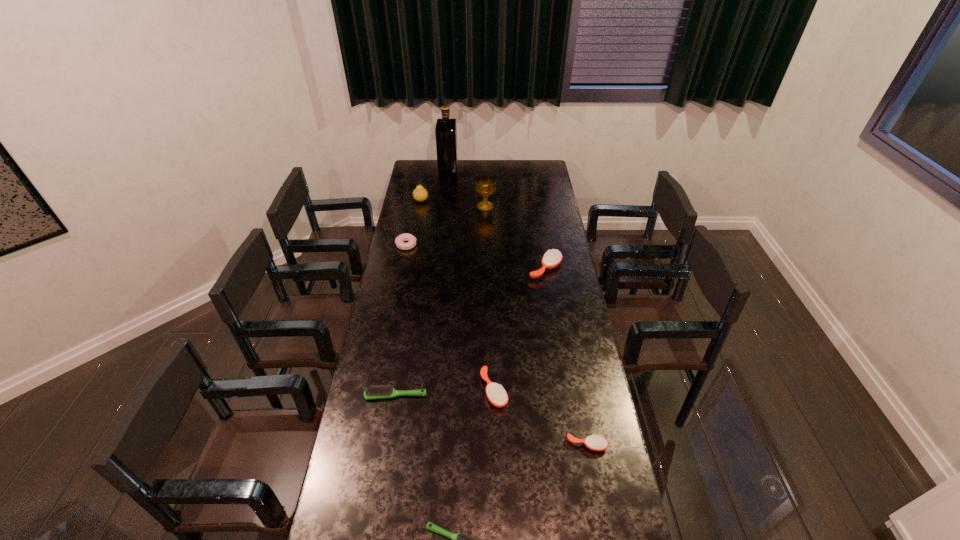
I want to click on free spot between the purple doughnut and the biggest orange hairbrush, so click(476, 256).

This screenshot has height=540, width=960. In order to click on empty location between the fifth farthest object and the nearest orange hairbrush in this screenshot , I will do `click(566, 357)`.

Image resolution: width=960 pixels, height=540 pixels. Find the location of `free area in between the liquor and the eighth shortest object`. free area in between the liquor and the eighth shortest object is located at coordinates (467, 187).

The height and width of the screenshot is (540, 960). I want to click on unoccupied position between the doughnut and the seventh shortest object, so click(414, 222).

This screenshot has width=960, height=540. Identify the location of free space between the fourth shortest hairbrush and the fourth farthest object. (450, 318).

Locate an element on the screen. The image size is (960, 540). free space between the farthest object and the second nearest object is located at coordinates (517, 306).

Locate an element on the screen. The height and width of the screenshot is (540, 960). vacant space that is in between the eighth shortest object and the smallest orange hairbrush is located at coordinates (536, 326).

Find the location of a particular element. Image resolution: width=960 pixels, height=540 pixels. object that is the second closest to the bigger light hairbrush is located at coordinates (459, 539).

Select which object appears as the fifth closest to the eighth shortest object. Please provide its 2D coordinates. Your answer should be formatted as a tuple, i.e. [(x, y)], where the tuple contains the x and y coordinates of a point satisfying the conditions above.

[(496, 394)]

Locate which hairbrush is the fourth closest to the shortest hairbrush. Please provide its 2D coordinates. Your answer should be formatted as a tuple, i.e. [(x, y)], where the tuple contains the x and y coordinates of a point satisfying the conditions above.

[(552, 258)]